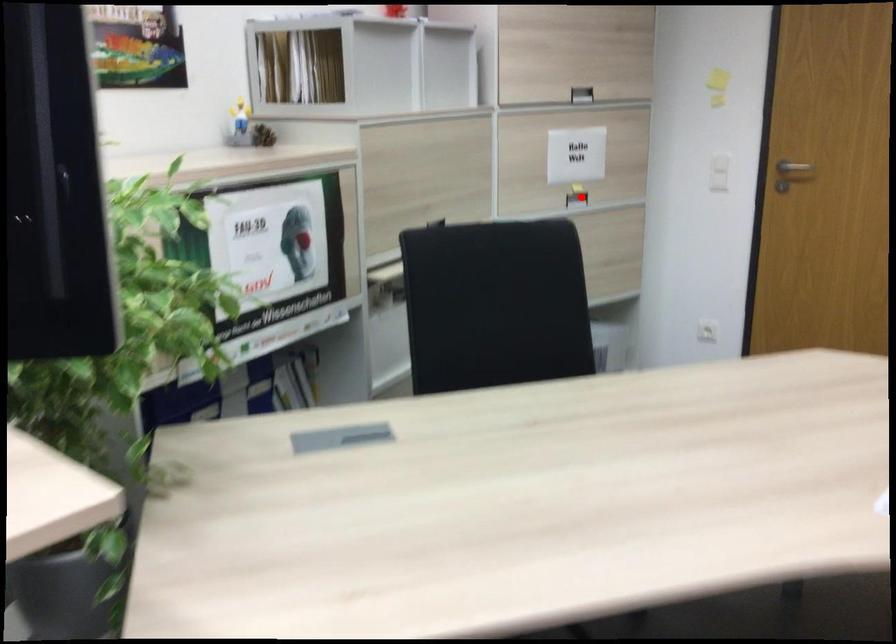
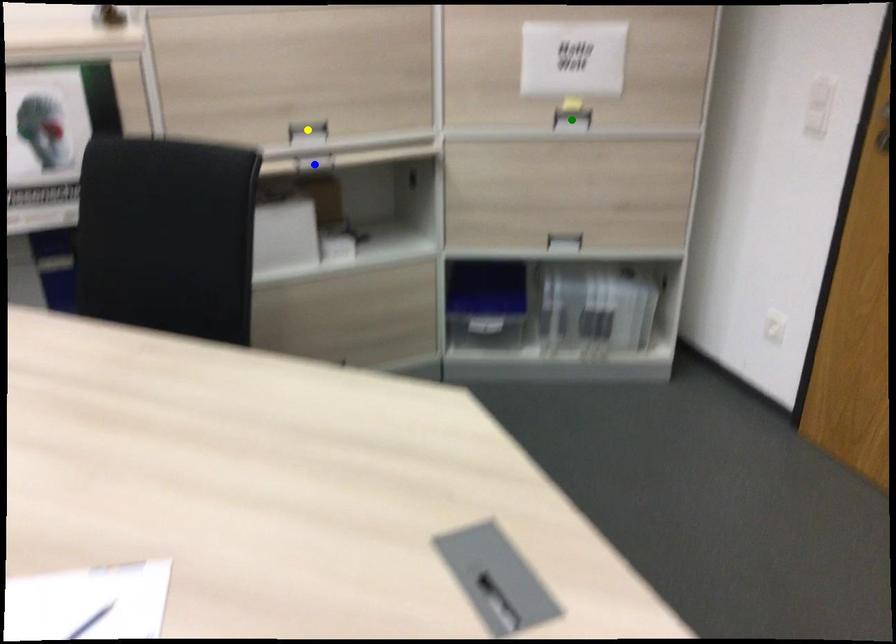
Question: I am providing you with two images of the same scene from different viewpoints. A red point is marked on the first image. You are given multiple points on the second image. Which point in image 2 is actually the same real-world point as the red point in image 1?

Choices:
 (A) green point
 (B) blue point
 (C) yellow point

Answer: (A)